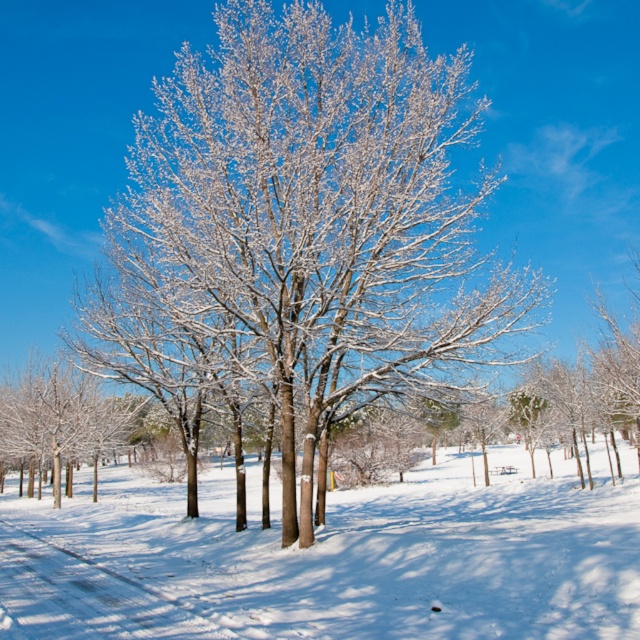
Consider the image. Which is more to the right, snow-covered tree at center or white snow-covered tree at left?

snow-covered tree at center

Who is positioned more to the left, snow-covered tree at center or white snow-covered tree at left?

white snow-covered tree at left is more to the left.

Is point (449, 145) more distant than point (58, 385)?

No.

The image size is (640, 640). I want to click on snow-covered tree at center, so click(312, 220).

Is white frosty snow at center above white snow-covered tree at left?

No.

Is point (468, 552) positioned after point (22, 376)?

No, (468, 552) is closer to viewer.

Is point (328, 515) in front of point (28, 429)?

Yes, it is.

This screenshot has height=640, width=640. I want to click on white frosty snow at center, so click(x=330, y=557).

Who is more distant from viewer, (x=339, y=177) or (x=144, y=490)?

Positioned behind is point (x=144, y=490).

Identify the location of snow-covered tree at center. (312, 220).